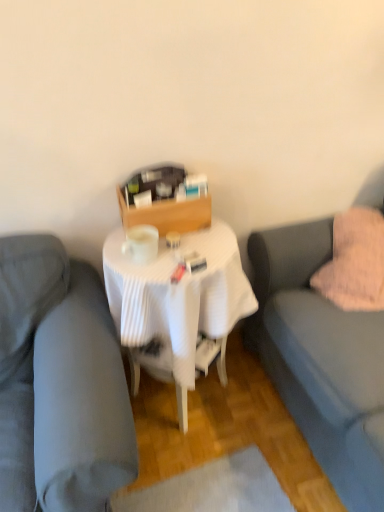
Question: Is soft gray fabric couch at right, arranged as the 1th studio couch when viewed from the right, smaller than pink fluffy pillow at right?

Choices:
 (A) no
 (B) yes

Answer: (A)

Question: Are soft gray fabric couch at right, arranged as the 1th studio couch when viewed from the right, and pink fluffy pillow at right beside each other?

Choices:
 (A) yes
 (B) no

Answer: (B)

Question: From the image's perspective, is soft gray fabric couch at right, arranged as the 1th studio couch when viewed from the right, on top of pink fluffy pillow at right?

Choices:
 (A) yes
 (B) no

Answer: (B)

Question: Is soft gray fabric couch at right, the second studio couch in the left-to-right sequence, to the right of pink fluffy pillow at right from the viewer's perspective?

Choices:
 (A) yes
 (B) no

Answer: (A)

Question: Does soft gray fabric couch at right, arranged as the 1th studio couch when viewed from the right, have a greater height compared to pink fluffy pillow at right?

Choices:
 (A) yes
 (B) no

Answer: (A)

Question: Does soft gray fabric couch at right, arranged as the 1th studio couch when viewed from the right, have a lesser width compared to pink fluffy pillow at right?

Choices:
 (A) yes
 (B) no

Answer: (B)

Question: Is pink fluffy pillow at right positioned in front of white pleated tablecloth at center?

Choices:
 (A) no
 (B) yes

Answer: (A)

Question: Is pink fluffy pillow at right at the left side of white pleated tablecloth at center?

Choices:
 (A) no
 (B) yes

Answer: (A)

Question: Is pink fluffy pillow at right positioned with its back to white pleated tablecloth at center?

Choices:
 (A) no
 (B) yes

Answer: (A)

Question: From a real-world perspective, is pink fluffy pillow at right on top of white pleated tablecloth at center?

Choices:
 (A) no
 (B) yes

Answer: (B)

Question: Considering the relative sizes of pink fluffy pillow at right and white pleated tablecloth at center in the image provided, is pink fluffy pillow at right shorter than white pleated tablecloth at center?

Choices:
 (A) no
 (B) yes

Answer: (B)

Question: Can you confirm if pink fluffy pillow at right is smaller than white pleated tablecloth at center?

Choices:
 (A) yes
 (B) no

Answer: (A)

Question: Is matte gray couch at center, the first studio couch positioned from the left, completely or partially inside pink fluffy pillow at right?

Choices:
 (A) no
 (B) yes

Answer: (A)